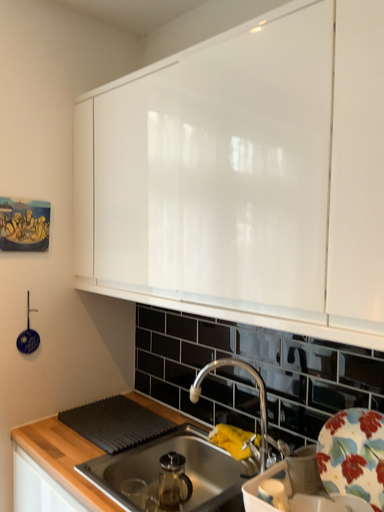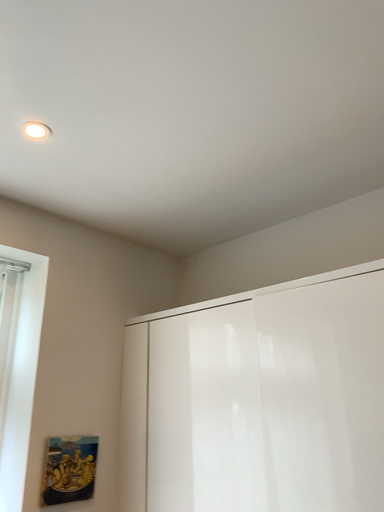
Question: How did the camera likely rotate when shooting the video?

Choices:
 (A) rotated upward
 (B) rotated downward

Answer: (A)